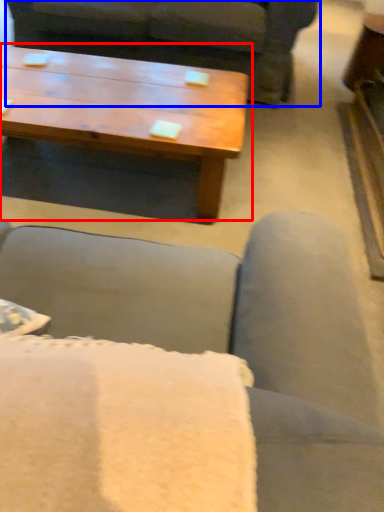
Question: Which object appears closest to the camera in this image, coffee table (highlighted by a red box) or studio couch (highlighted by a blue box)?

Choices:
 (A) coffee table
 (B) studio couch

Answer: (A)